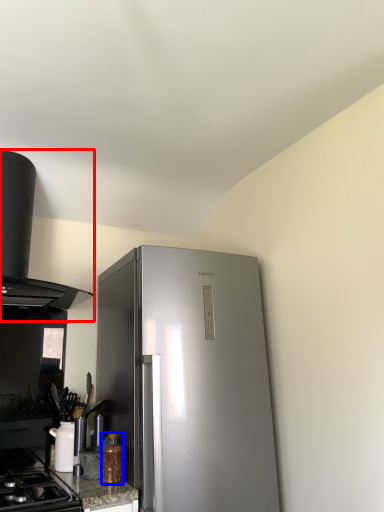
Question: Which point is closer to the camera, kitchen appliance (highlighted by a red box) or bottle (highlighted by a blue box)?

Choices:
 (A) kitchen appliance
 (B) bottle

Answer: (A)